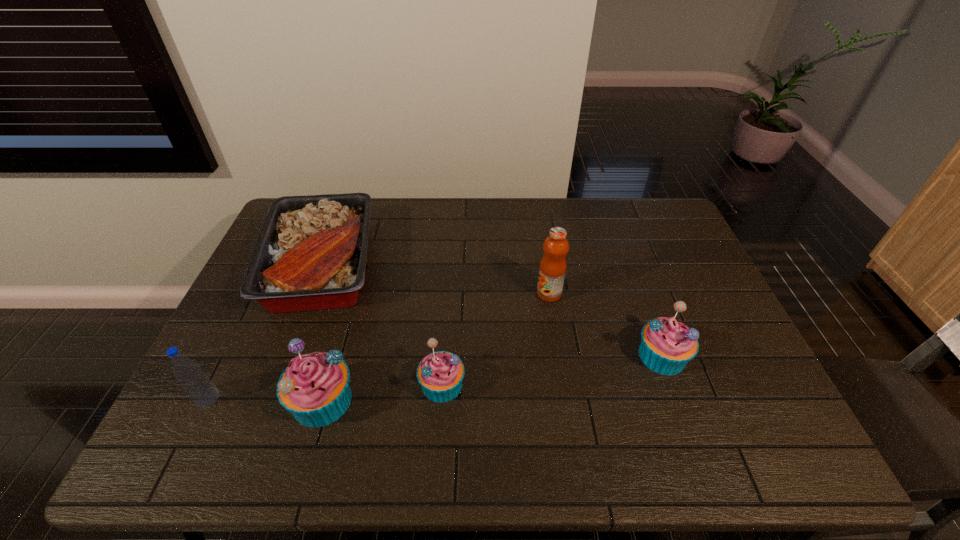
If the aim is uniform spacing by inserting an additional muffin among them, please point to a vacant space for this new muffin. Please provide its 2D coordinates. Your answer should be formatted as a tuple, i.e. [(x, y)], where the tuple contains the x and y coordinates of a point satisfying the conditions above.

[(555, 370)]